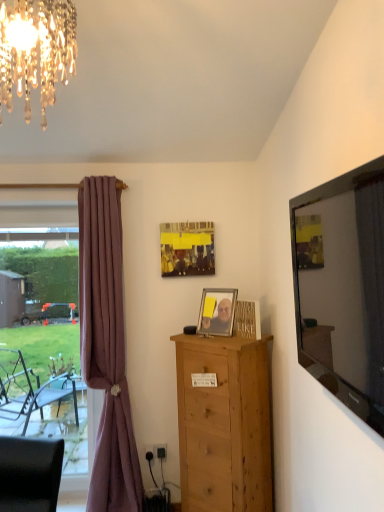
Question: Considering the relative positions of crystal glass chandelier at upper left and metallic silver picture frame at center, the 1th picture frame from the front, in the image provided, is crystal glass chandelier at upper left in front of metallic silver picture frame at center, the 1th picture frame from the front,?

Choices:
 (A) yes
 (B) no

Answer: (A)

Question: Is there a large distance between crystal glass chandelier at upper left and metallic silver picture frame at center, acting as the first picture frame starting from the bottom?

Choices:
 (A) yes
 (B) no

Answer: (A)

Question: Considering the relative sizes of crystal glass chandelier at upper left and metallic silver picture frame at center, acting as the first picture frame starting from the bottom, in the image provided, is crystal glass chandelier at upper left shorter than metallic silver picture frame at center, acting as the first picture frame starting from the bottom,?

Choices:
 (A) yes
 (B) no

Answer: (B)

Question: From the image's perspective, is crystal glass chandelier at upper left located above metallic silver picture frame at center, the 1th picture frame from the front?

Choices:
 (A) no
 (B) yes

Answer: (B)

Question: Is crystal glass chandelier at upper left wider than metallic silver picture frame at center, the 1th picture frame from the front?

Choices:
 (A) no
 (B) yes

Answer: (B)

Question: Considering the relative positions of matte yellow picture frame at center, marked as the 2th picture frame in a bottom-to-top arrangement, and metallic silver picture frame at center, which is the second picture frame in top-to-bottom order, in the image provided, is matte yellow picture frame at center, marked as the 2th picture frame in a bottom-to-top arrangement, to the left or to the right of metallic silver picture frame at center, which is the second picture frame in top-to-bottom order,?

Choices:
 (A) left
 (B) right

Answer: (A)

Question: Is matte yellow picture frame at center, which is the 2th picture frame from front to back, bigger or smaller than metallic silver picture frame at center, which is the 2th picture frame in back-to-front order?

Choices:
 (A) big
 (B) small

Answer: (A)

Question: Which is correct: matte yellow picture frame at center, which is the 2th picture frame from front to back, is inside metallic silver picture frame at center, which is the second picture frame in top-to-bottom order, or outside of it?

Choices:
 (A) outside
 (B) inside

Answer: (A)

Question: Is matte yellow picture frame at center, the 1th picture frame positioned from the top, wider or thinner than metallic silver picture frame at center, the 1th picture frame from the front?

Choices:
 (A) thin
 (B) wide

Answer: (A)

Question: From the image's perspective, relative to matte yellow picture frame at center, which is the 2th picture frame from front to back, is clear glass window at left above or below?

Choices:
 (A) above
 (B) below

Answer: (B)

Question: Looking at their shapes, would you say clear glass window at left is wider or thinner than matte yellow picture frame at center, the 1th picture frame positioned from the top?

Choices:
 (A) thin
 (B) wide

Answer: (B)

Question: Is clear glass window at left inside the boundaries of matte yellow picture frame at center, the 1th picture frame positioned from the top, or outside?

Choices:
 (A) inside
 (B) outside

Answer: (B)

Question: In the image, is clear glass window at left positioned in front of or behind matte yellow picture frame at center, marked as the 2th picture frame in a bottom-to-top arrangement?

Choices:
 (A) behind
 (B) front

Answer: (A)

Question: From the image's perspective, is flat glass mirror at right above or below natural wood chest of drawers at center?

Choices:
 (A) above
 (B) below

Answer: (A)

Question: In the image, is flat glass mirror at right on the left side or the right side of natural wood chest of drawers at center?

Choices:
 (A) left
 (B) right

Answer: (B)